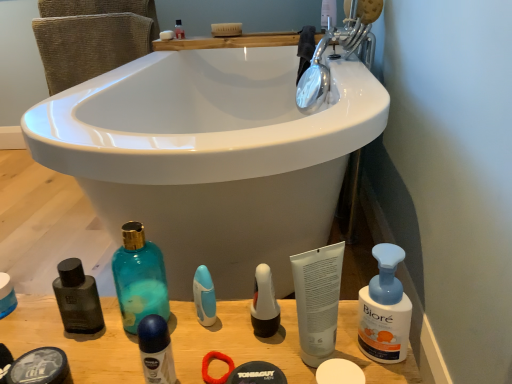
Where is `vacant region to the left of blue plastic toothbrush at center, acting as the fourth toiletry starting from the top`? Image resolution: width=512 pixels, height=384 pixels. vacant region to the left of blue plastic toothbrush at center, acting as the fourth toiletry starting from the top is located at coordinates (100, 336).